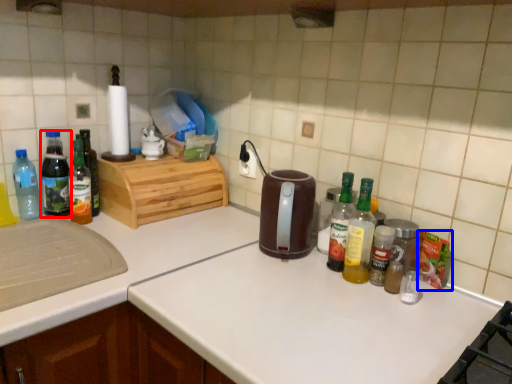
Question: Which object appears closest to the camera in this image, bottle (highlighted by a red box) or food (highlighted by a blue box)?

Choices:
 (A) bottle
 (B) food

Answer: (B)